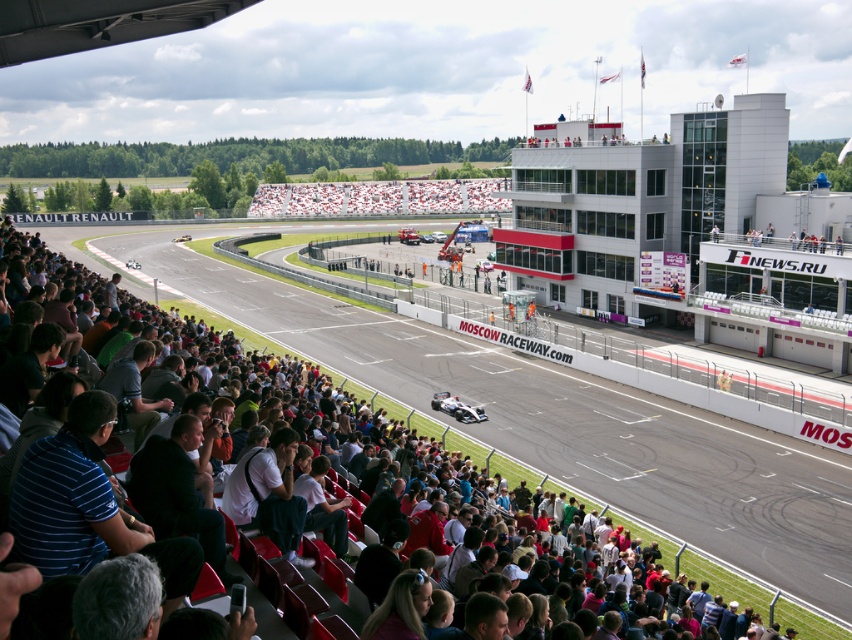
Question: Which object is farther from the camera taking this photo?

Choices:
 (A) dark gray fabric seats at lower left
 (B) white shirt at lower center

Answer: (B)

Question: Is white checkered seats at center to the right of white shirt at lower center from the viewer's perspective?

Choices:
 (A) no
 (B) yes

Answer: (A)

Question: Is dark gray fabric seats at lower left bigger than white shirt at lower center?

Choices:
 (A) yes
 (B) no

Answer: (A)

Question: Which point is closer to the camera?

Choices:
 (A) (246, 493)
 (B) (318, 196)
 (C) (467, 493)

Answer: (A)

Question: Among these objects, which one is farthest from the camera?

Choices:
 (A) dark gray fabric seats at lower left
 (B) white checkered seats at center

Answer: (B)

Question: Is dark gray fabric seats at lower left to the left of white shirt at lower center from the viewer's perspective?

Choices:
 (A) no
 (B) yes

Answer: (B)